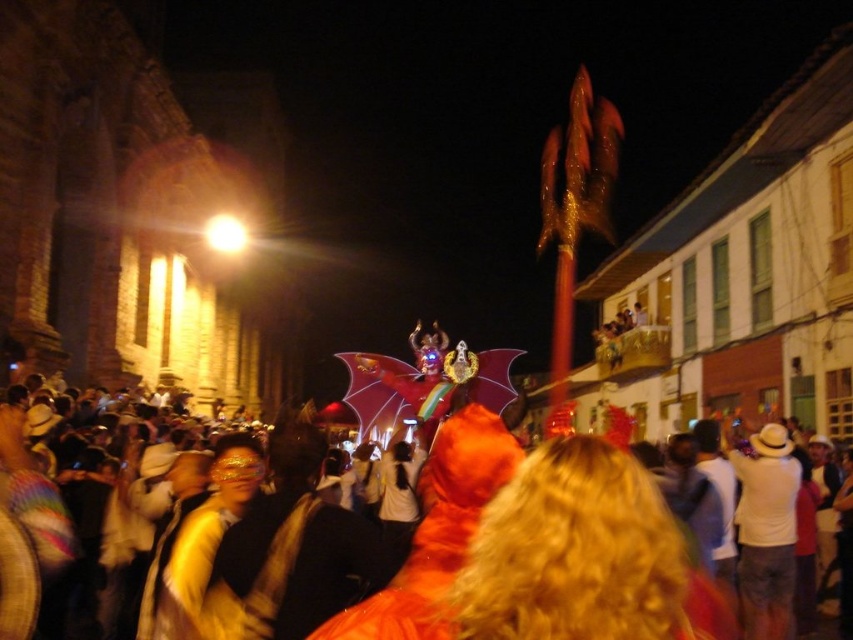
Question: Can you confirm if orange fur coat at center is positioned to the left of orange furry costume at center?

Choices:
 (A) yes
 (B) no

Answer: (A)

Question: Among these objects, which one is farthest from the camera?

Choices:
 (A) orange furry costume at center
 (B) orange fur coat at center

Answer: (A)

Question: Does orange fur coat at center come in front of orange furry costume at center?

Choices:
 (A) yes
 (B) no

Answer: (A)

Question: Among these objects, which one is nearest to the camera?

Choices:
 (A) orange fur coat at center
 (B) orange furry costume at center

Answer: (A)

Question: Which object appears farthest from the camera in this image?

Choices:
 (A) orange furry costume at center
 (B) orange fur coat at center

Answer: (A)

Question: In this image, where is orange fur coat at center located relative to orange furry costume at center?

Choices:
 (A) above
 (B) below

Answer: (B)